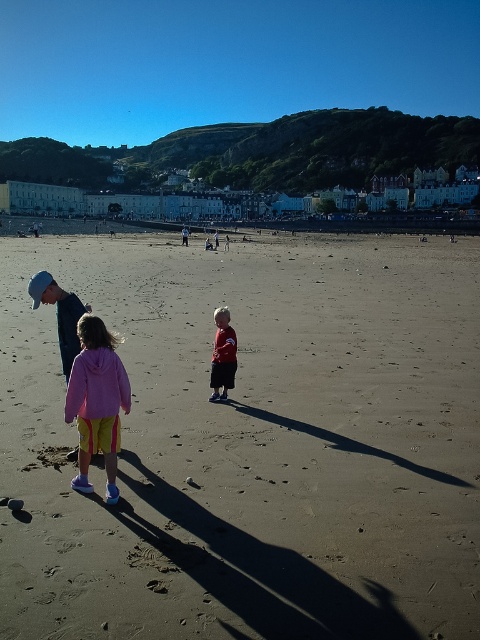
Which of these two, pink fleece jacket at center or matte red shirt at center, stands taller?

pink fleece jacket at center

Where is `pink fleece jacket at center`? This screenshot has width=480, height=640. pink fleece jacket at center is located at coordinates (96, 401).

Can you confirm if brown sandy beach at center is shorter than pink fleece jacket at center?

No.

The image size is (480, 640). What do you see at coordinates (252, 444) in the screenshot? I see `brown sandy beach at center` at bounding box center [252, 444].

Does point (317, 476) come farther from viewer compared to point (108, 384)?

Yes, it is.

Locate an element on the screen. The width and height of the screenshot is (480, 640). brown sandy beach at center is located at coordinates (252, 444).

Does brown sandy beach at center have a greater height compared to matte red shirt at center?

Indeed, brown sandy beach at center has a greater height compared to matte red shirt at center.

Does brown sandy beach at center have a smaller size compared to matte red shirt at center?

No.

Describe the element at coordinates (252, 444) in the screenshot. I see `brown sandy beach at center` at that location.

At what (x,y) coordinates should I click in order to perform the action: click on brown sandy beach at center. Please return your answer as a coordinate pair (x, y). Looking at the image, I should click on (252, 444).